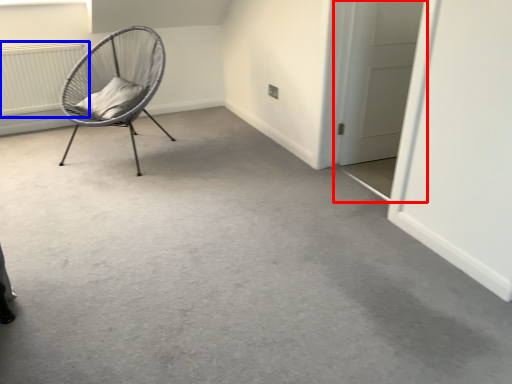
Question: Which object is closer to the camera taking this photo, door (highlighted by a red box) or radiator (highlighted by a blue box)?

Choices:
 (A) door
 (B) radiator

Answer: (A)